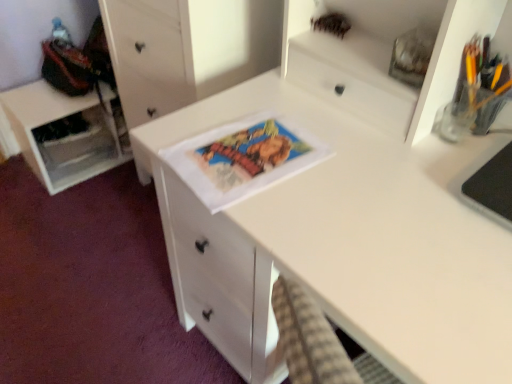
Question: Is translucent glass pencil holder at upper right to the left or to the right of matte paper comic book at center in the image?

Choices:
 (A) left
 (B) right

Answer: (B)

Question: Relative to matte paper comic book at center, is translucent glass pencil holder at upper right in front or behind?

Choices:
 (A) behind
 (B) front

Answer: (B)

Question: Considering the real-world distances, which object is farthest from the white matte cabinet at left?

Choices:
 (A) white matte desk at center
 (B) matte paper comic book at center
 (C) translucent glass pencil holder at upper right
 (D) white matte chest of drawers at center

Answer: (C)

Question: Based on their relative distances, which object is nearer to the translucent glass pencil holder at upper right?

Choices:
 (A) white matte cabinet at left
 (B) matte paper comic book at center
 (C) white matte desk at center
 (D) white matte chest of drawers at center

Answer: (B)